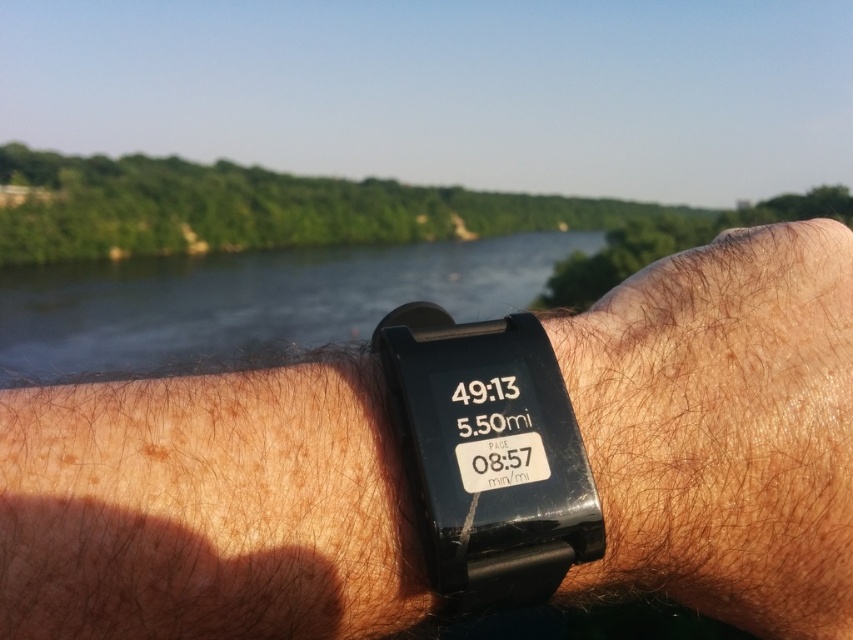
You are a photographer who wants to capture a close detail of the brown hairy skin at center and dark blue water at center in the image. Which object will appear larger in the photo?

The dark blue water at center will appear larger in the photo because the brown hairy skin at center is smaller than it.

You are taking a photo of the fitness tracker on the wrist. There are two points marked on the tracker screen at coordinates point [381,596] and point [560,513]. Which point appears closer to the camera in the photo?

Point [381,596] is further to the camera than point [560,513], so point [381,596] appears closer to the camera in the photo.

You are a fitness enthusiast who just finished a run. You look down at your wrist and see both the black matte watch at center and the black plastic watch at center. Which one do you think has the larger display screen?

The black matte watch at center has a larger display screen since it is larger in size than the black plastic watch at center.